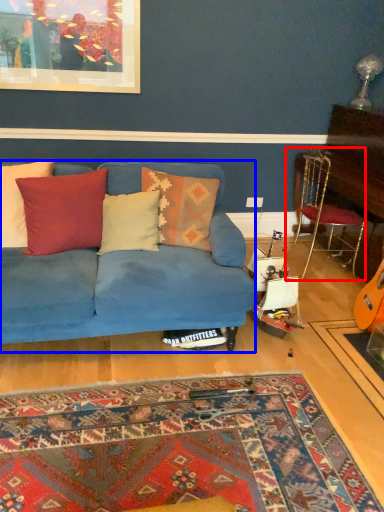
Question: Which object appears farthest to the camera in this image, chair (highlighted by a red box) or studio couch (highlighted by a blue box)?

Choices:
 (A) chair
 (B) studio couch

Answer: (A)